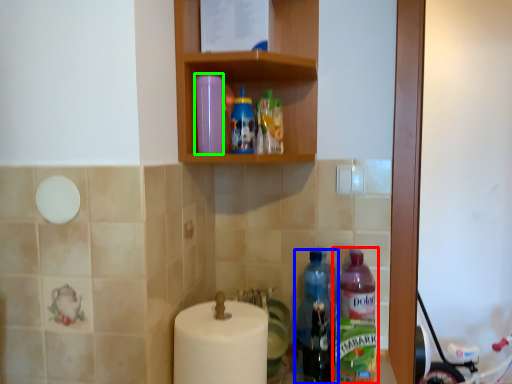
Question: Which object is the farthest from bottle (highlighted by a red box)? Choose among these: bottle (highlighted by a blue box) or bottle (highlighted by a green box).

Choices:
 (A) bottle
 (B) bottle

Answer: (B)